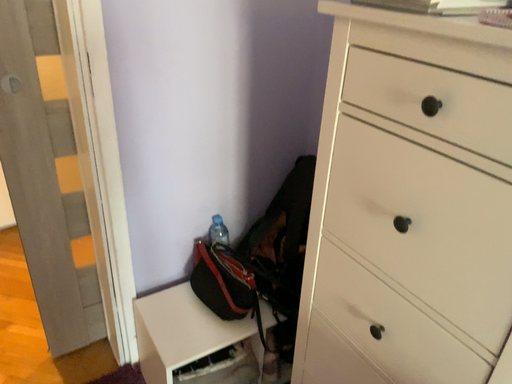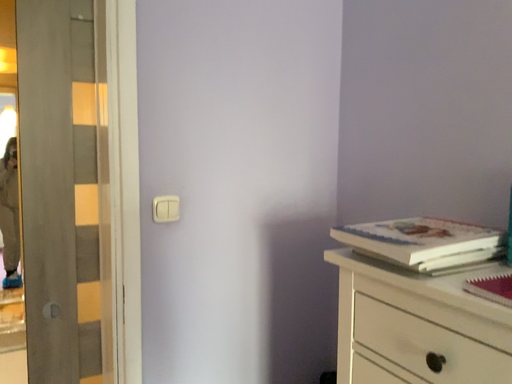
Question: Which way did the camera rotate in the video?

Choices:
 (A) rotated upward
 (B) rotated downward

Answer: (A)